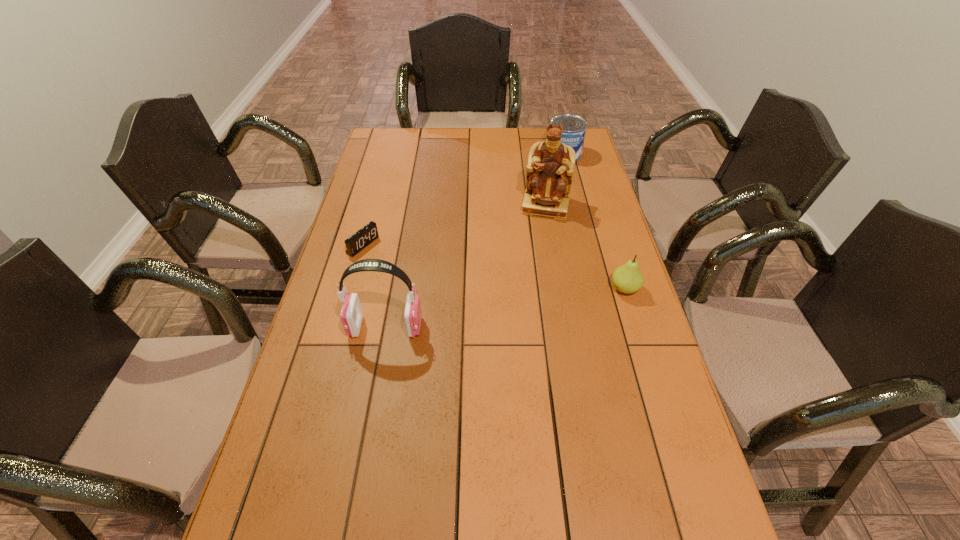
You are a GUI agent. You are given a task and a screenshot of the screen. Output one action in this format:
    pyautogui.click(x=<x>, y=<y>)
    Task: Click on the free space on the desktop that is between the nearest object and the pear and is positioned on the front-facing side of the shortest object
    The height and width of the screenshot is (540, 960).
    Given the screenshot: What is the action you would take?
    pyautogui.click(x=487, y=311)

Identify the location of vacant spot on the desktop that is between the second tallest object and the second nearest object and is positioned on the front-facing side of the tallest object. This screenshot has width=960, height=540. (524, 305).

Locate an element on the screen. The width and height of the screenshot is (960, 540). free space on the desktop that is between the nearest object and the pear and is positioned on the front label of the can is located at coordinates (490, 310).